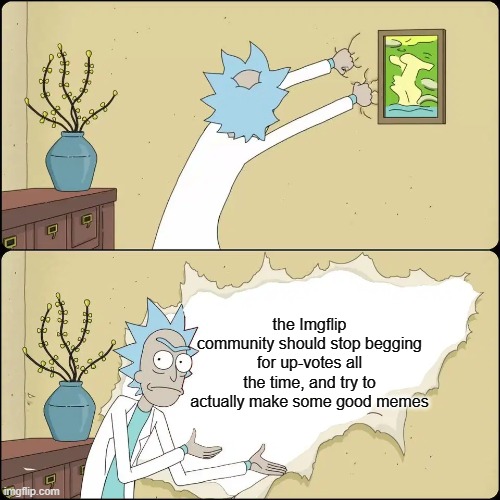
Identify the location of upper screen brown picture frame. The image size is (500, 500). (416, 120).